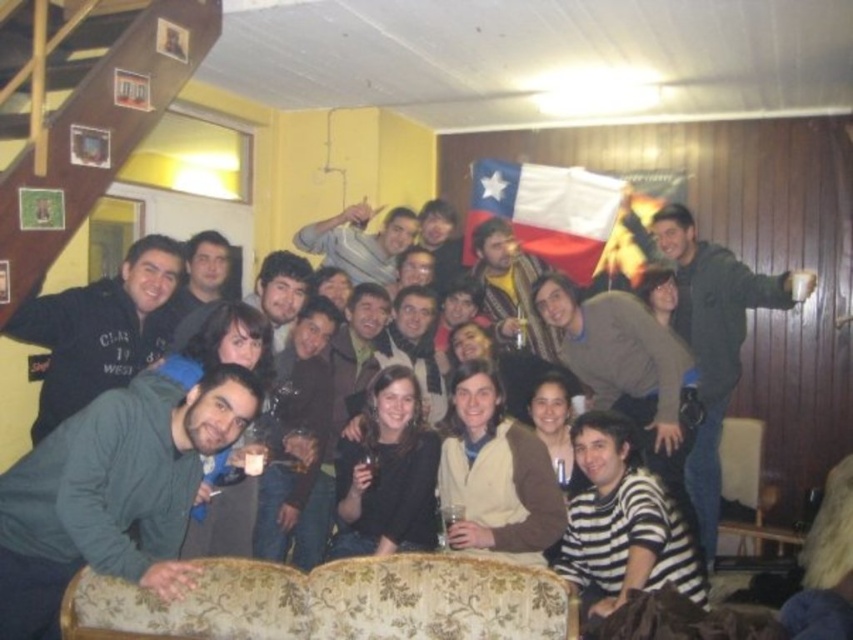
Question: Does white fabric flag at center appear on the right side of dark gray sweater at center?

Choices:
 (A) yes
 (B) no

Answer: (A)

Question: Does striped sweater at center have a smaller size compared to dark gray hoodie at left?

Choices:
 (A) yes
 (B) no

Answer: (B)

Question: Which object is positioned closest to the matte brown scarf at center?

Choices:
 (A) white fabric flag at center
 (B) dark gray hoodie at center

Answer: (A)

Question: Among these objects, which one is farthest from the camera?

Choices:
 (A) dark gray hoodie at left
 (B) white fabric flag at center

Answer: (B)

Question: Which point appears closest to the camera in this image?

Choices:
 (A) (558, 340)
 (B) (679, 492)
 (C) (51, 342)
 (D) (704, 464)

Answer: (C)

Question: Is white fabric flag at center positioned before light gray sweater at center?

Choices:
 (A) no
 (B) yes

Answer: (A)